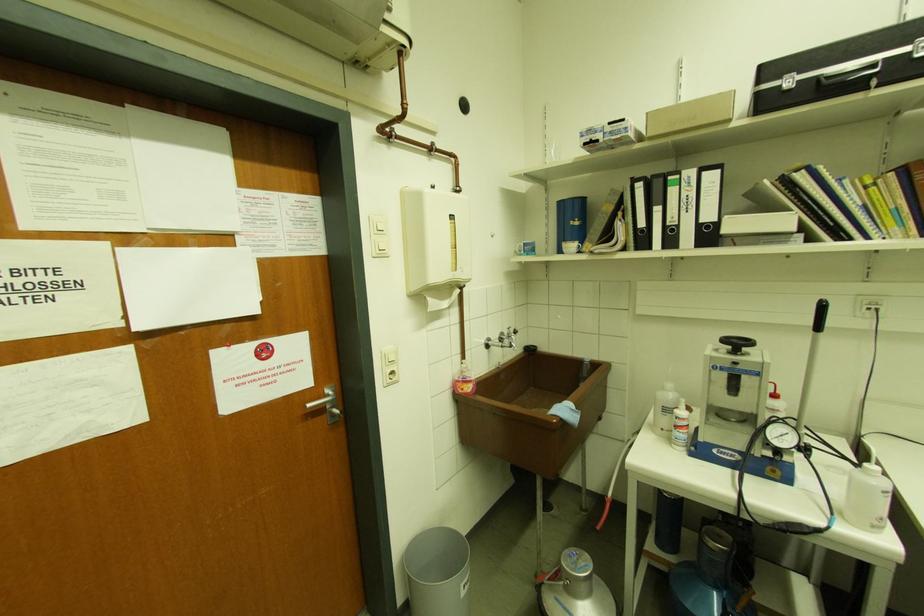
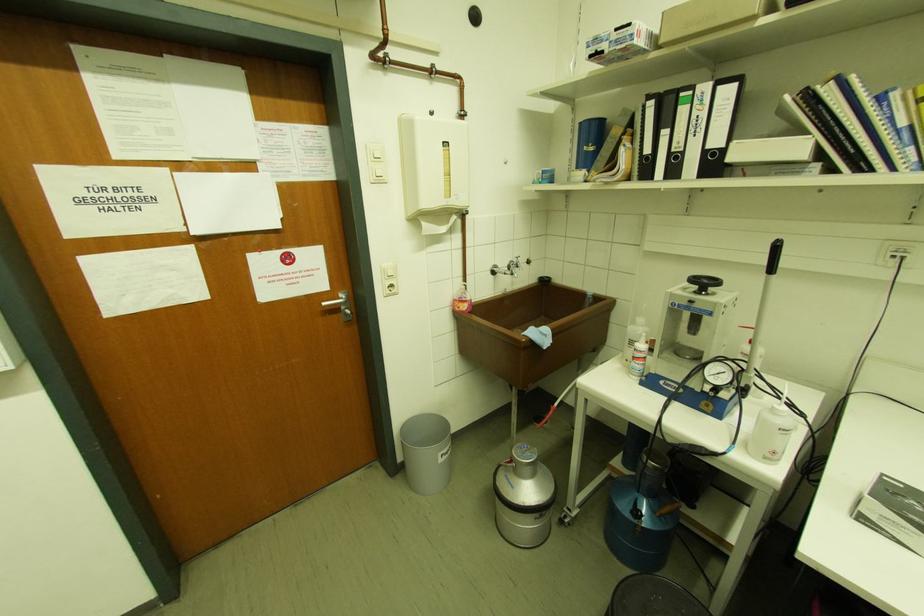
Locate, in the second image, the point that corresponds to (385,256) in the first image.

(383, 182)